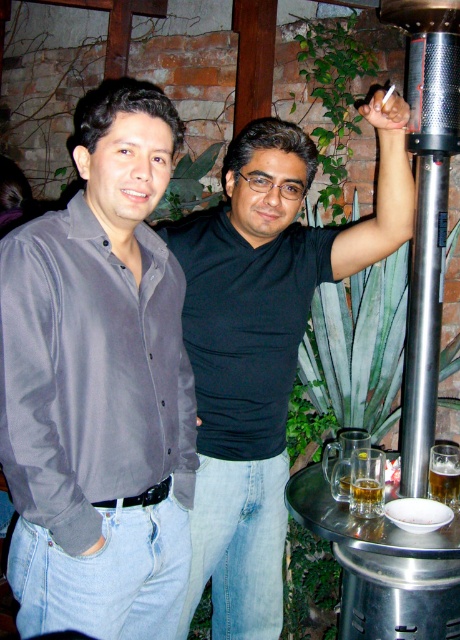
You are at a social gathering and want to grab a drink. You see a silver metallic pole at upper right and a translucent glass beer at lower right. Which object is closer to the right side of the scene?

The translucent glass beer at lower right is closer to the right side of the scene because the silver metallic pole at upper right is positioned on its left side.